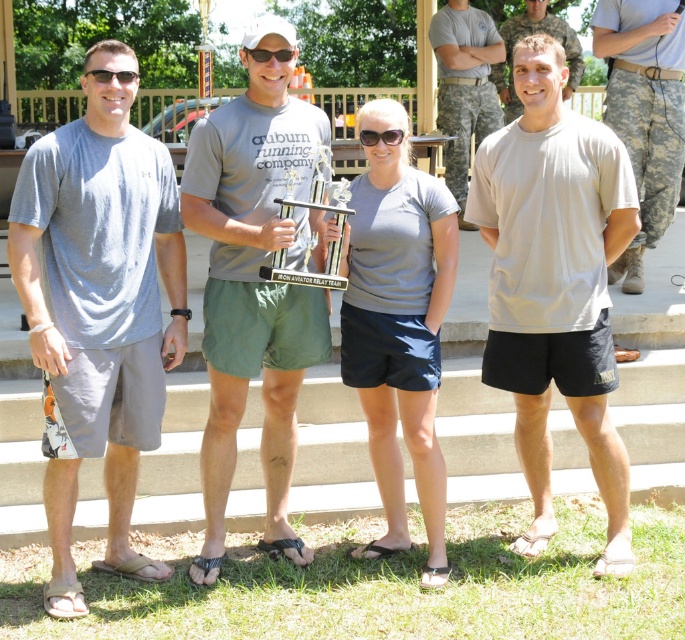
In order to click on camouflage uniform at right in this screenshot , I will do `click(464, 86)`.

At what (x,y) coordinates should I click in order to perform the action: click on camouflage uniform at right. Please return your answer as a coordinate pair (x, y). The width and height of the screenshot is (685, 640). Looking at the image, I should click on (464, 86).

Find the location of a particular element. camouflage uniform at right is located at coordinates (464, 86).

What are the coordinates of `transparent plastic goggles at center` in the screenshot? It's located at (379, 136).

Can you confirm if transparent plastic goggles at center is positioned to the right of matte black sunglasses at upper left?

Correct, you'll find transparent plastic goggles at center to the right of matte black sunglasses at upper left.

Who is more forward, (384, 132) or (97, 77)?

Point (97, 77) is more forward.

Where is `transparent plastic goggles at center`? transparent plastic goggles at center is located at coordinates (379, 136).

In the scene shown: Between camouflage pants at center and camouflage uniform at right, which one appears on the right side from the viewer's perspective?

Positioned to the right is camouflage pants at center.

In the scene shown: Does camouflage pants at center have a larger size compared to camouflage uniform at right?

No, camouflage pants at center is not bigger than camouflage uniform at right.

Which is in front, point (675, 104) or point (473, 131)?

Point (675, 104) is more forward.

Where is `camouflage pants at center`? Image resolution: width=685 pixels, height=640 pixels. camouflage pants at center is located at coordinates (645, 112).